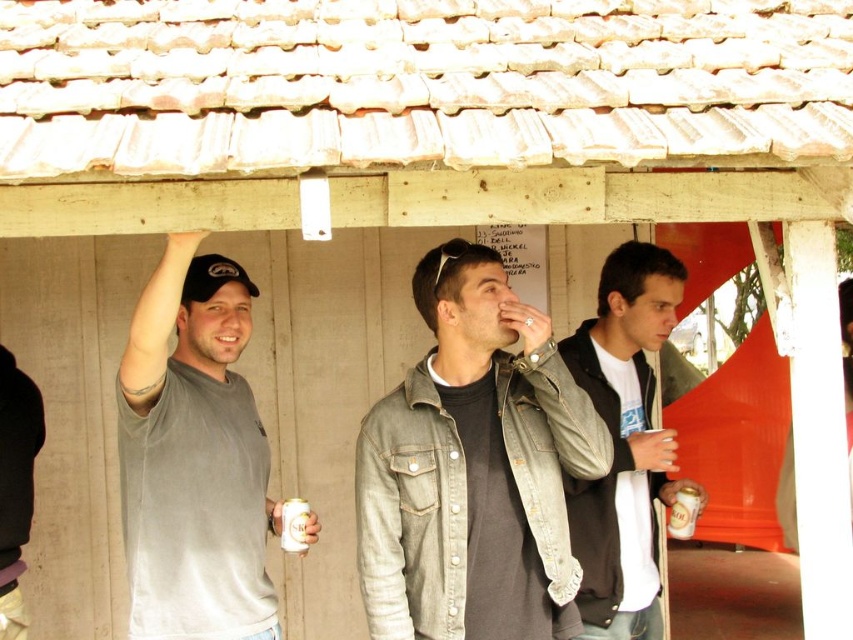
Question: Is gray matte t-shirt at upper left smaller than dark gray hoodie at center?

Choices:
 (A) no
 (B) yes

Answer: (A)

Question: Among these points, which one is farthest from the camera?

Choices:
 (A) (672, 438)
 (B) (161, 627)

Answer: (A)

Question: Which of the following is the farthest from the observer?

Choices:
 (A) (281, 516)
 (B) (186, 317)
 (C) (637, 429)

Answer: (C)

Question: Which of the following is the farthest from the observer?

Choices:
 (A) denim jacket at center
 (B) metallic silver can at center
 (C) dark gray hoodie at center

Answer: (B)

Question: From the image, what is the correct spatial relationship of dark gray hoodie at center in relation to metallic silver can at center?

Choices:
 (A) above
 (B) below

Answer: (A)

Question: Can you confirm if gray matte t-shirt at upper left is positioned to the left of metallic silver can at center?

Choices:
 (A) yes
 (B) no

Answer: (A)